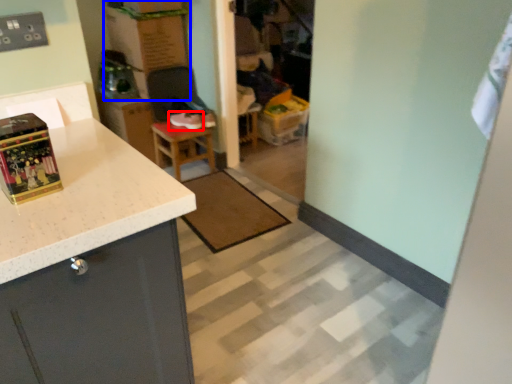
Question: Among these objects, which one is farthest to the camera, footwear (highlighted by a red box) or cardboard box (highlighted by a blue box)?

Choices:
 (A) footwear
 (B) cardboard box

Answer: (A)